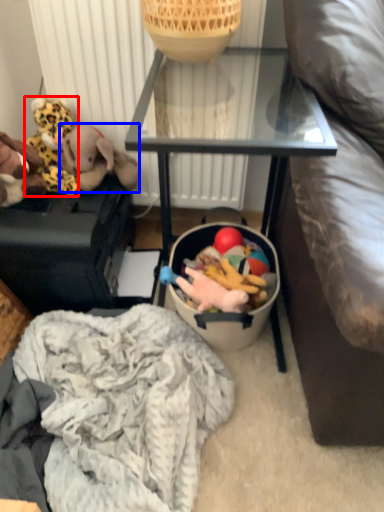
Question: Which object appears closest to the camera in this image, toy (highlighted by a red box) or toy (highlighted by a blue box)?

Choices:
 (A) toy
 (B) toy

Answer: (B)